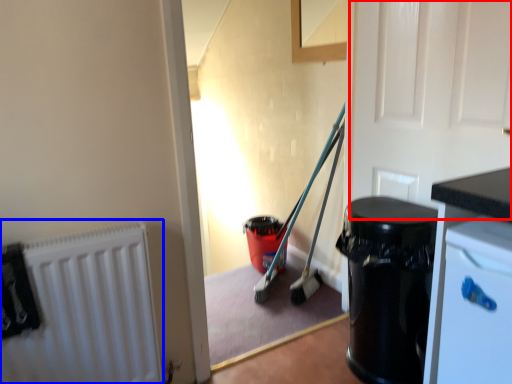
Question: Which object is further to the camera taking this photo, door (highlighted by a red box) or radiator (highlighted by a blue box)?

Choices:
 (A) door
 (B) radiator

Answer: (B)